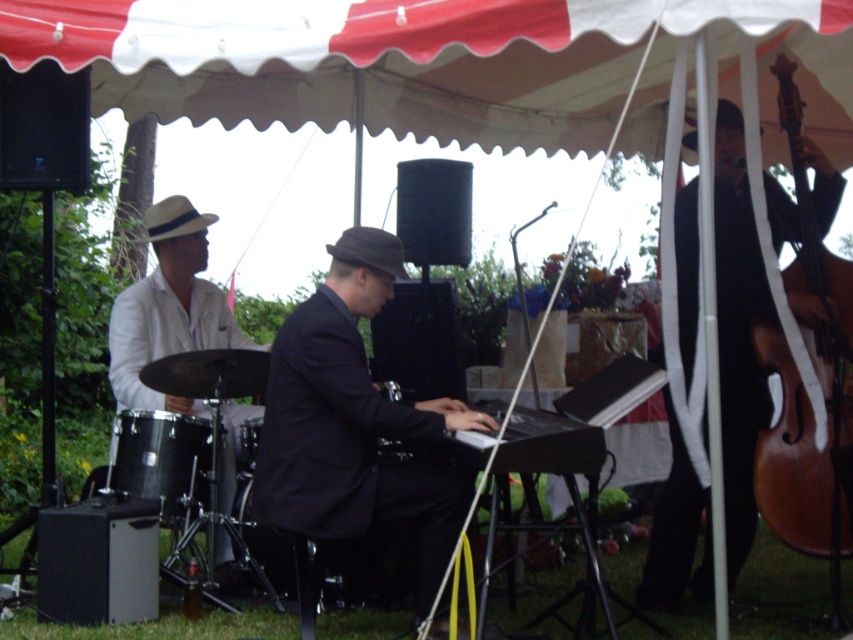
Question: Which point is farther from the camera taking this photo?

Choices:
 (A) (167, 474)
 (B) (675, 552)
 (C) (148, 276)
 (D) (450, 516)

Answer: (C)

Question: Which point is closer to the camera taking this photo?

Choices:
 (A) tap(180, 310)
 (B) tap(273, 580)
 (C) tap(178, 211)
 (D) tap(796, 483)

Answer: (D)

Question: Which object is farther from the camera taking this photo?

Choices:
 (A) black matte suit at center
 (B) wooden bass at right
 (C) white matte suit at left

Answer: (C)

Question: Is brown wooden violin at right below black drum at lower left?

Choices:
 (A) yes
 (B) no

Answer: (B)

Question: From the image, what is the correct spatial relationship of black metallic drum at lower left in relation to black drum at center?

Choices:
 (A) right
 (B) left

Answer: (B)

Question: Is white matte suit at left behind black drum at lower left?

Choices:
 (A) yes
 (B) no

Answer: (B)